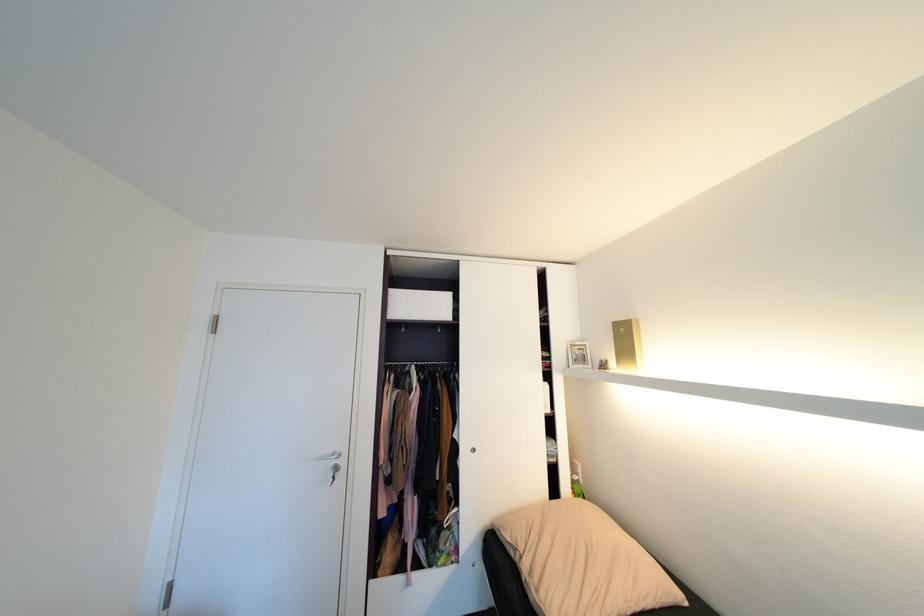
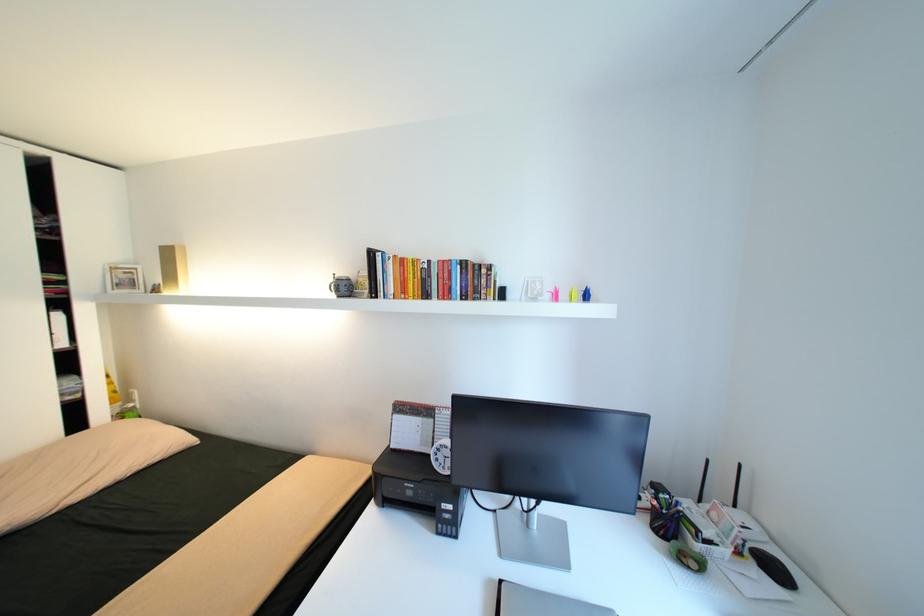
Where in the second image is the point corresponding to pixel 611 360 from the first image?

(164, 284)